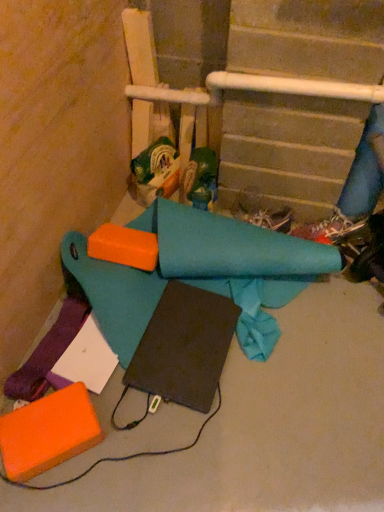
Find the location of a particular element. Image resolution: width=384 pixels, height=512 pixels. vacant space to the right of black matte notebook at center is located at coordinates (298, 362).